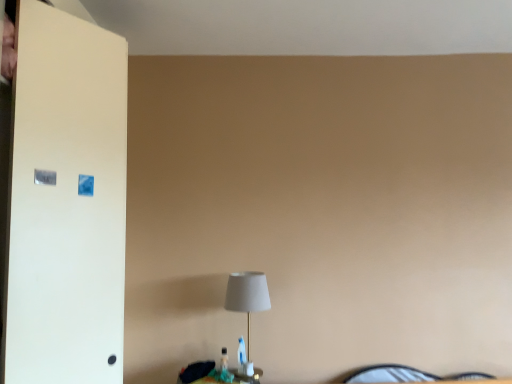
You are a GUI agent. You are given a task and a screenshot of the screen. Output one action in this format:
    pyautogui.click(x=<x>, y=<y>)
    Task: Click on the white fabric lampshade at center
    This screenshot has width=512, height=384.
    Given the screenshot: What is the action you would take?
    pyautogui.click(x=248, y=309)

What do you see at coordinates (248, 309) in the screenshot?
I see `white fabric lampshade at center` at bounding box center [248, 309].

In order to face white fabric lampshade at center, should I rotate leftwards or rightwards?

Turn left approximately 0.798 degrees to face it.

This screenshot has width=512, height=384. Identify the location of white fabric lampshade at center. (248, 309).